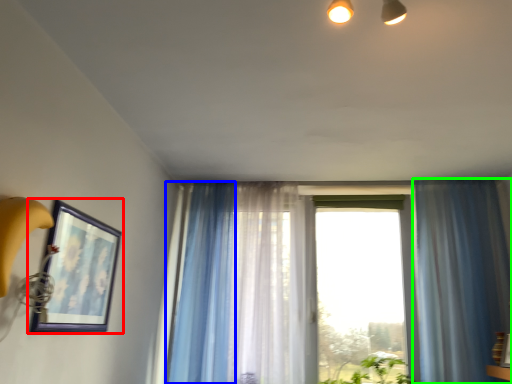
Question: Based on their relative distances, which object is farther from picture frame (highlighted by a red box)? Choose from curtain (highlighted by a blue box) and curtain (highlighted by a green box).

Choices:
 (A) curtain
 (B) curtain

Answer: (B)